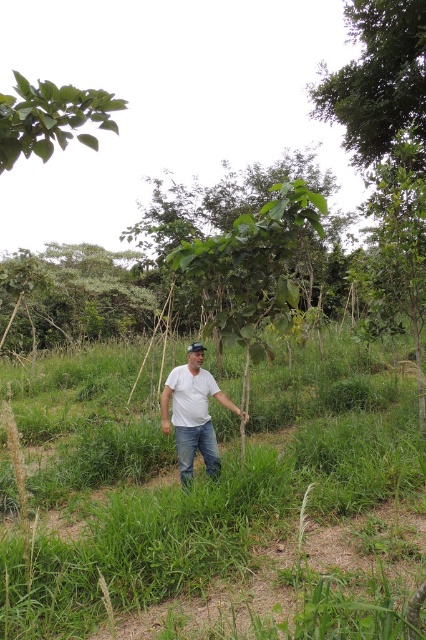
Question: Which object is closer to the camera taking this photo?

Choices:
 (A) green leafy tree at upper right
 (B) green grass at center

Answer: (B)

Question: Among these points, which one is farthest from the camera?

Choices:
 (A) (94, 141)
 (B) (204, 442)
 (C) (379, 0)

Answer: (C)

Question: Can you confirm if green leafy tree at center is positioned to the left of green leafy tree at upper left?

Choices:
 (A) yes
 (B) no

Answer: (A)

Question: Is green grass at center above green leafy tree at center?

Choices:
 (A) no
 (B) yes

Answer: (A)

Question: In this image, where is green leafy tree at center located relative to green leafy tree at upper left?

Choices:
 (A) above
 (B) below

Answer: (B)

Question: Which point is closer to the camera?

Choices:
 (A) green leafy tree at upper left
 (B) green leafy tree at upper right

Answer: (A)